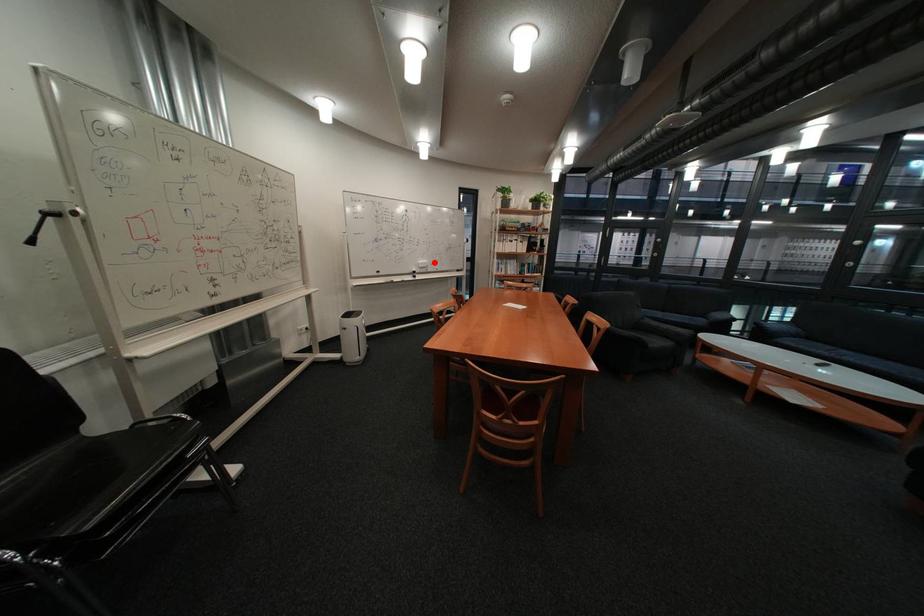
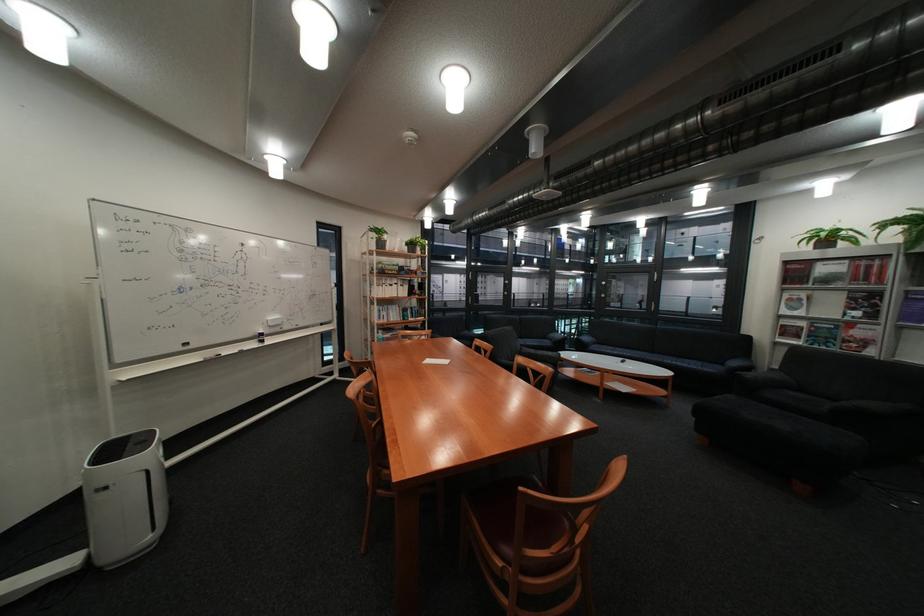
Where in the second image is the point corresponding to the highlighted location from the first image?

(284, 318)